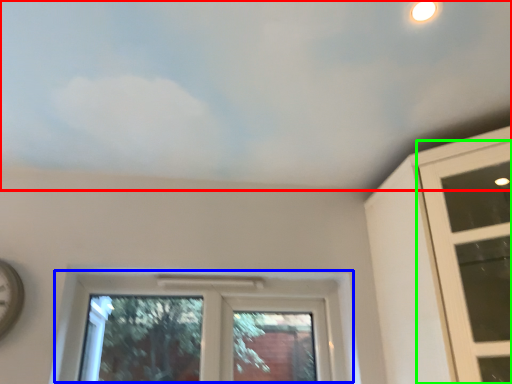
Question: Which object is positioned closest to cloud (highlighted by a red box)? Select from window (highlighted by a blue box) and window (highlighted by a green box).

Choices:
 (A) window
 (B) window

Answer: (B)